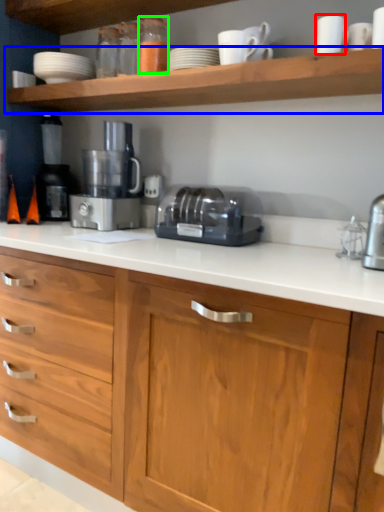
Question: Which is nearer to the tableware (highlighted by a red box)? shelf (highlighted by a blue box) or bottle (highlighted by a green box).

Choices:
 (A) shelf
 (B) bottle

Answer: (A)